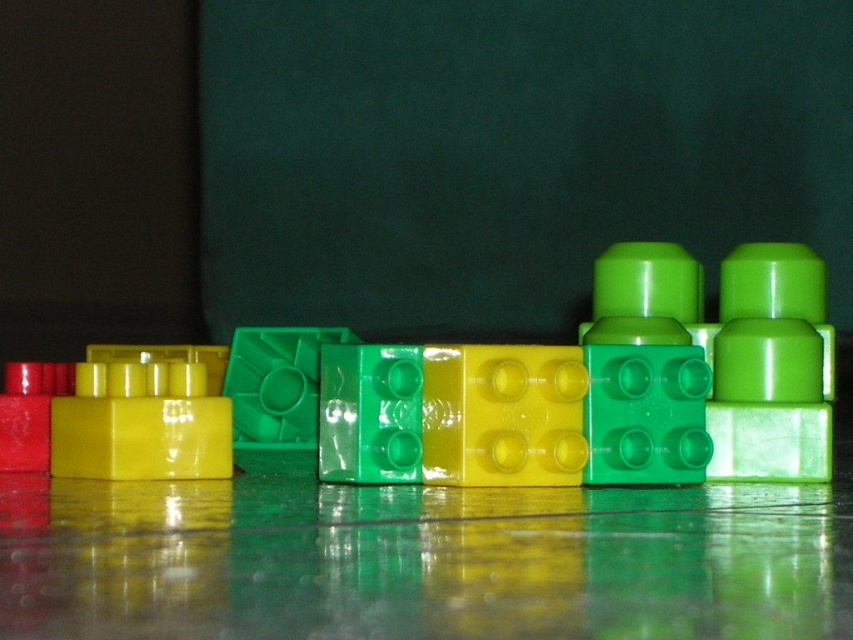
Question: Which point appears closest to the camera in this image?

Choices:
 (A) (45, 371)
 (B) (180, 451)
 (C) (709, 452)

Answer: (C)

Question: Observing the image, what is the correct spatial positioning of green plastic blocks at center in reference to matte red block at left?

Choices:
 (A) below
 (B) above

Answer: (B)

Question: Which point is closer to the camera taking this photo?

Choices:
 (A) (10, 442)
 (B) (300, 460)

Answer: (A)

Question: Is green plastic blocks at center in front of shiny yellow plastic block at left?

Choices:
 (A) yes
 (B) no

Answer: (A)

Question: Which object is closer to the camera taking this photo?

Choices:
 (A) matte red block at left
 (B) shiny yellow plastic block at left

Answer: (B)

Question: Does green plastic blocks at center have a smaller size compared to matte red block at left?

Choices:
 (A) yes
 (B) no

Answer: (B)